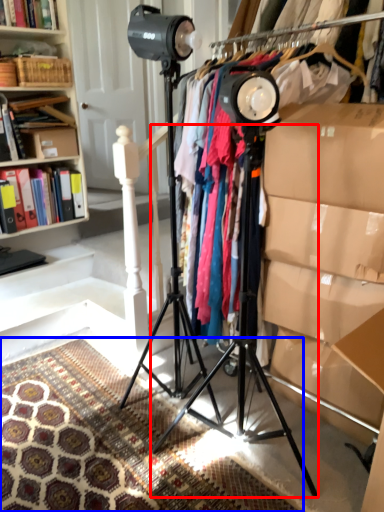
Question: Which object appears closest to the camera in this image, tripod (highlighted by a red box) or mat (highlighted by a blue box)?

Choices:
 (A) tripod
 (B) mat

Answer: (B)